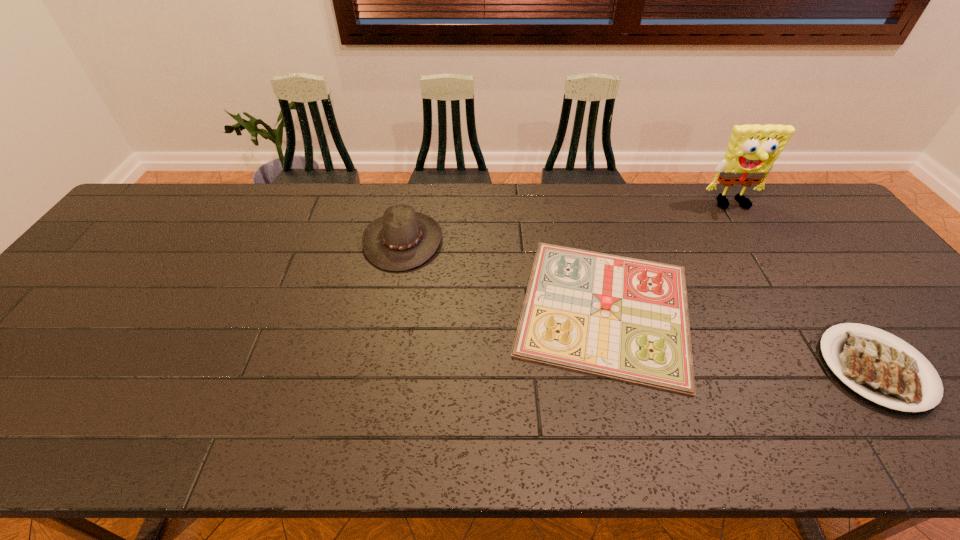
I want to click on the tallest object, so click(752, 150).

This screenshot has height=540, width=960. What are the coordinates of `the second tallest object` in the screenshot? It's located at (402, 239).

Image resolution: width=960 pixels, height=540 pixels. I want to click on hat, so click(x=402, y=239).

The width and height of the screenshot is (960, 540). Identify the location of the second shortest object. (622, 318).

The image size is (960, 540). Identify the location of gameboard. (622, 318).

Locate an element on the screen. This screenshot has height=540, width=960. vacant space situated on the face of the sponge is located at coordinates (765, 255).

Locate an element on the screen. Image resolution: width=960 pixels, height=540 pixels. vacant region located 0.160m on the front-facing side of the leftmost object is located at coordinates (496, 240).

Image resolution: width=960 pixels, height=540 pixels. Find the location of `vacant space located 0.170m on the back of the gameboard`. vacant space located 0.170m on the back of the gameboard is located at coordinates (579, 209).

The image size is (960, 540). Find the location of `sponge at the far edge`. sponge at the far edge is located at coordinates tap(752, 150).

At what (x,y) coordinates should I click in order to perform the action: click on hat at the far edge. Please return your answer as a coordinate pair (x, y). The height and width of the screenshot is (540, 960). Looking at the image, I should click on (402, 239).